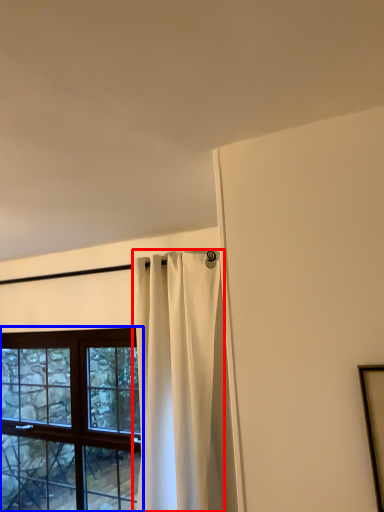
Question: Which point is closer to the camera, curtain (highlighted by a red box) or window (highlighted by a blue box)?

Choices:
 (A) curtain
 (B) window

Answer: (A)